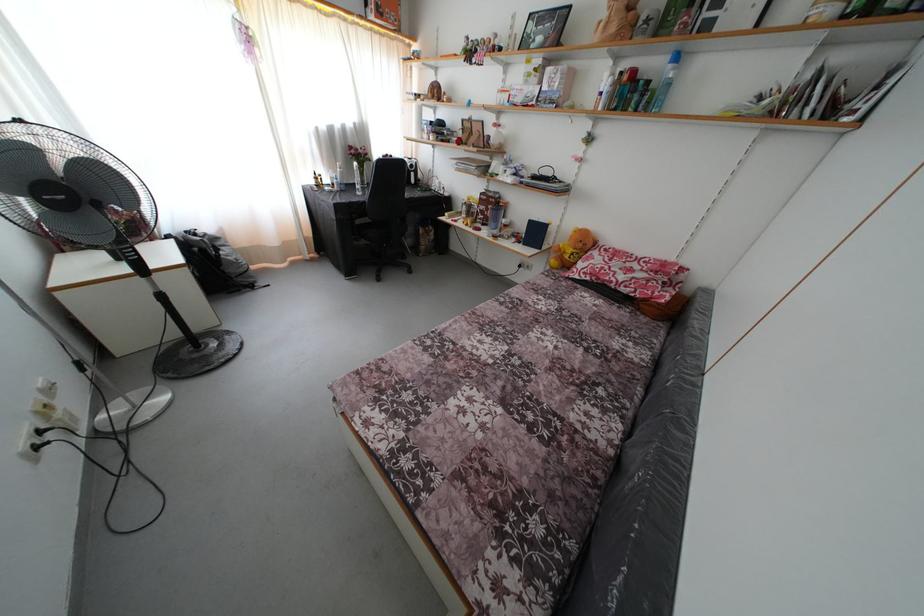
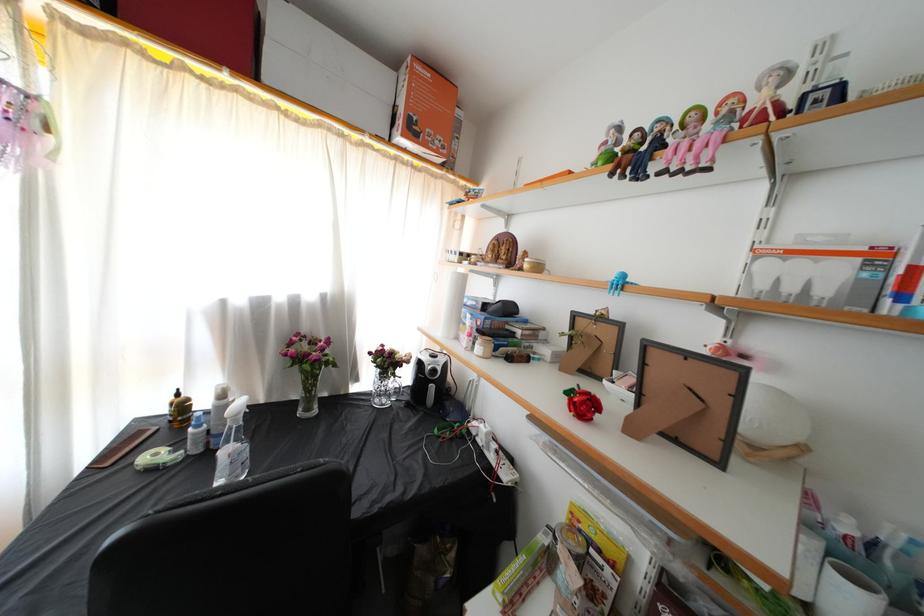
Where in the second image is the point corresponding to point 476,60 from the first image?

(638, 161)